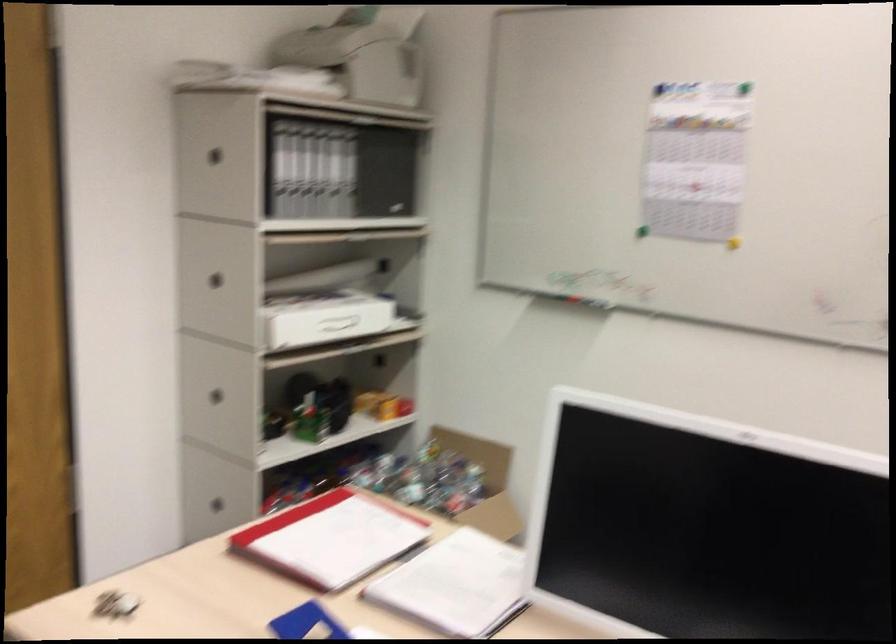
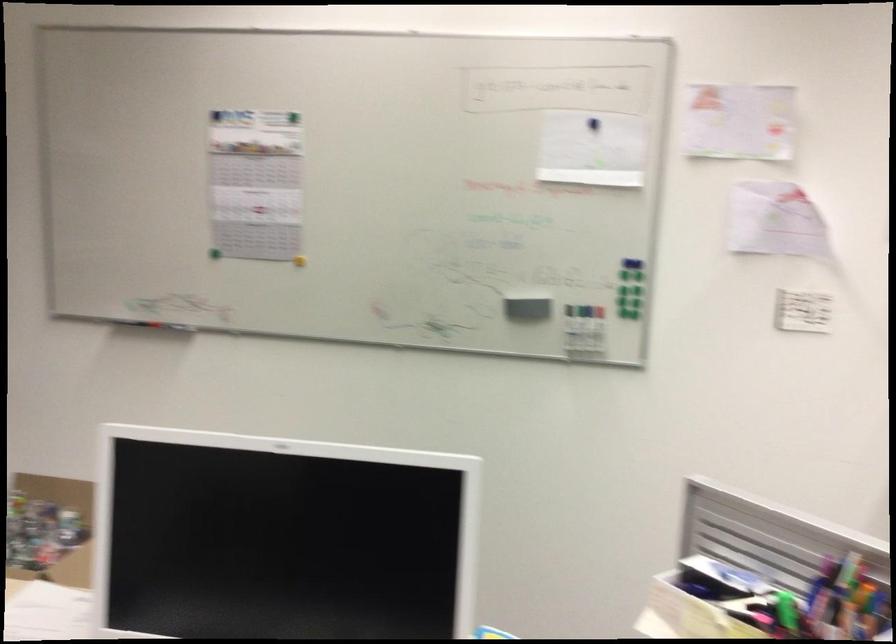
Find the pixel in the second image that matches pixel 742 82 in the first image.

(293, 118)